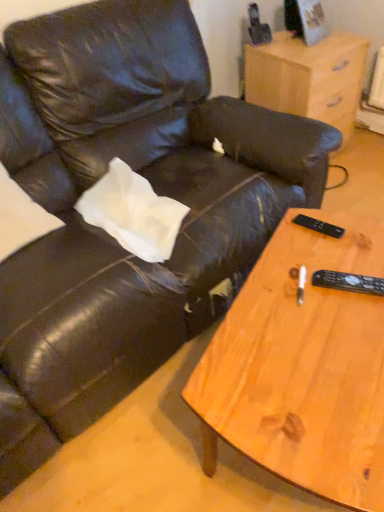
Question: From the image's perspective, is light wood/finely finished nightstand at upper right located above or below black plastic remote at right, the second remote positioned from the bottom?

Choices:
 (A) below
 (B) above

Answer: (B)

Question: Which is correct: light wood/finely finished nightstand at upper right is inside black plastic remote at right, the second remote from the front, or outside of it?

Choices:
 (A) outside
 (B) inside

Answer: (A)

Question: Which of these objects is positioned farthest from the wooden coffee table at lower right?

Choices:
 (A) light wood/finely finished nightstand at upper right
 (B) black plastic remote at right, the second remote positioned from the bottom
 (C) black plastic remote at right, the first remote from the front

Answer: (A)

Question: Which object is positioned closest to the wooden coffee table at lower right?

Choices:
 (A) black plastic remote at right, the first remote from the front
 (B) black plastic remote at right, the first remote viewed from the back
 (C) light wood/finely finished nightstand at upper right

Answer: (A)